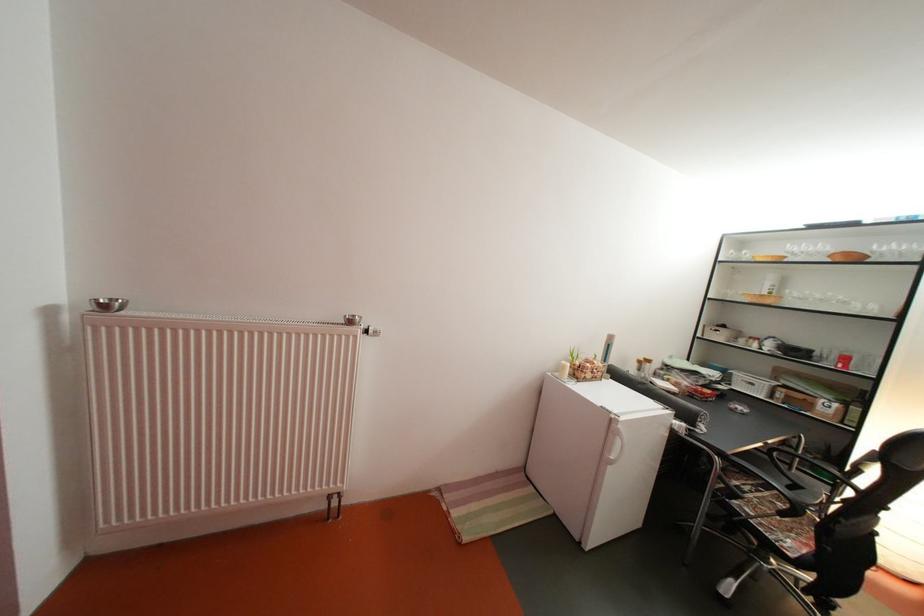
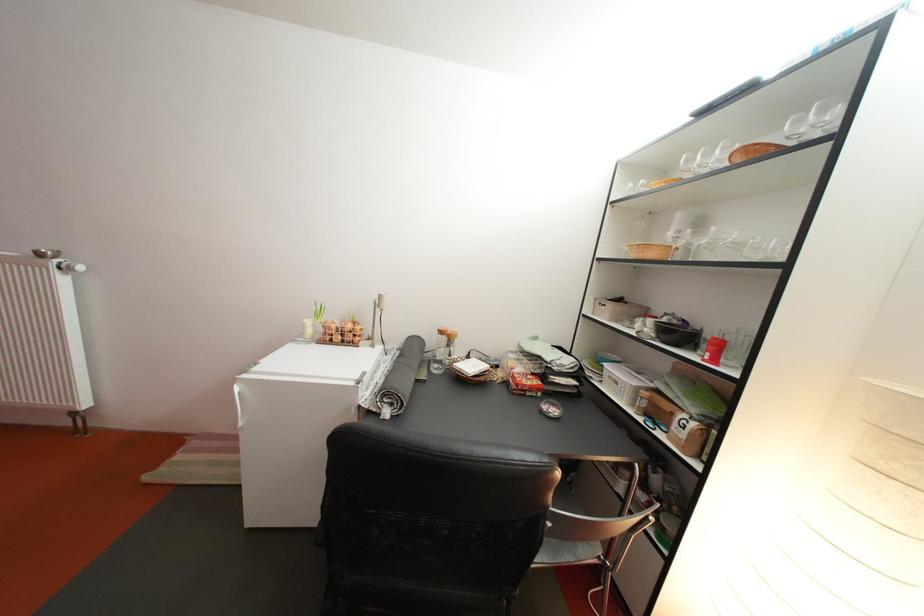
Question: The images are taken continuously from a first-person perspective. In which direction are you moving?

Choices:
 (A) Left
 (B) Right
 (C) Forward
 (D) Backward

Answer: (B)